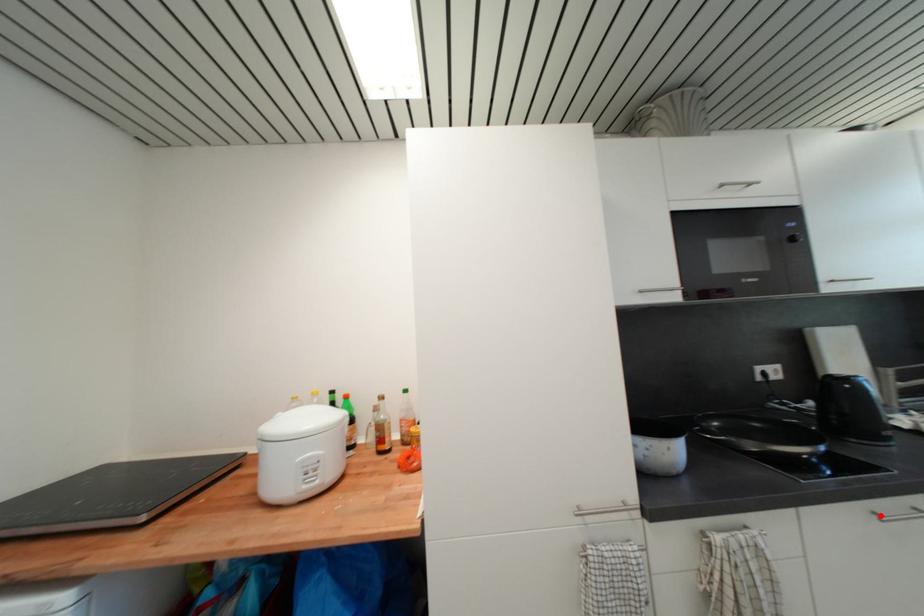
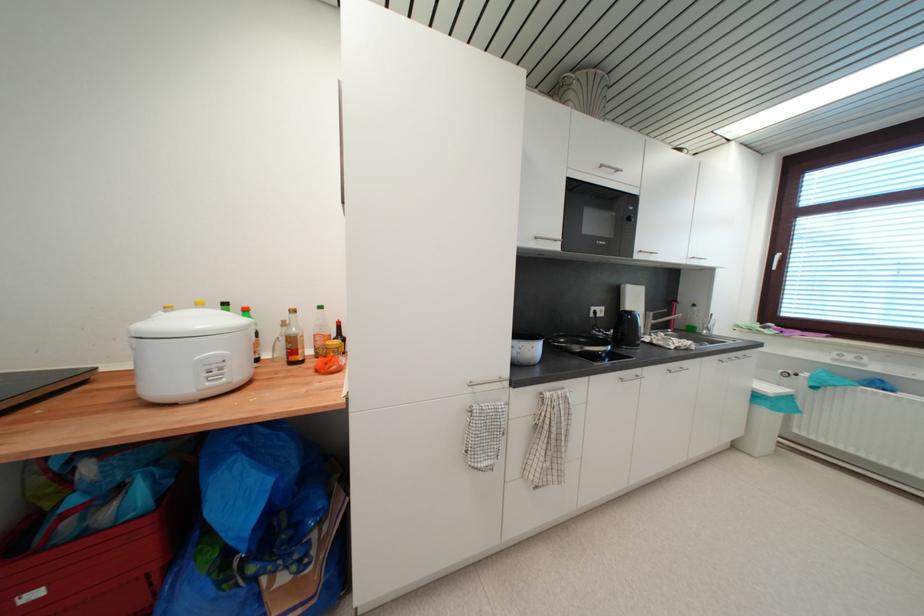
In the second image, find the point that corresponds to the highlighted location in the first image.

(626, 381)